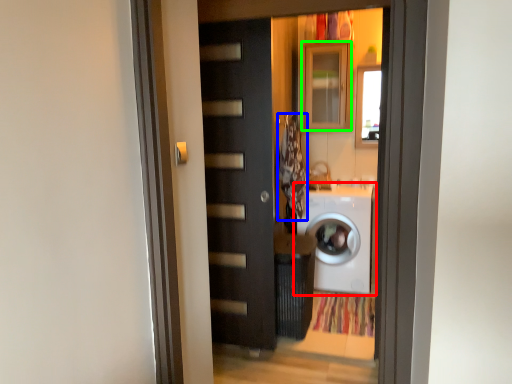
Question: Based on their relative distances, which object is farther from washing machine (highlighted by a red box)? Choose from laundry (highlighted by a blue box) and cabinetry (highlighted by a green box).

Choices:
 (A) laundry
 (B) cabinetry

Answer: (B)